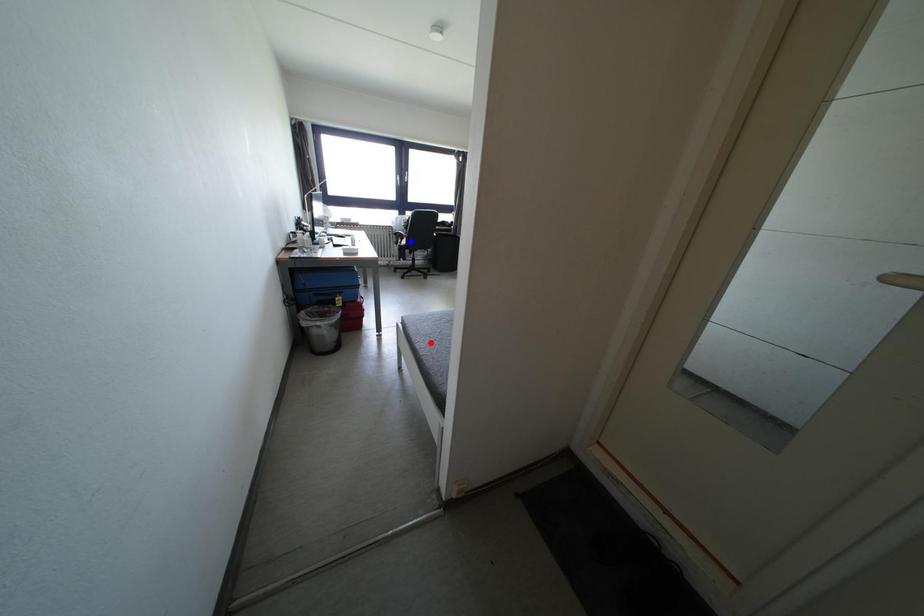
Question: Which of the two points in the image is closer to the camera?

Choices:
 (A) Blue point is closer.
 (B) Red point is closer.

Answer: (B)